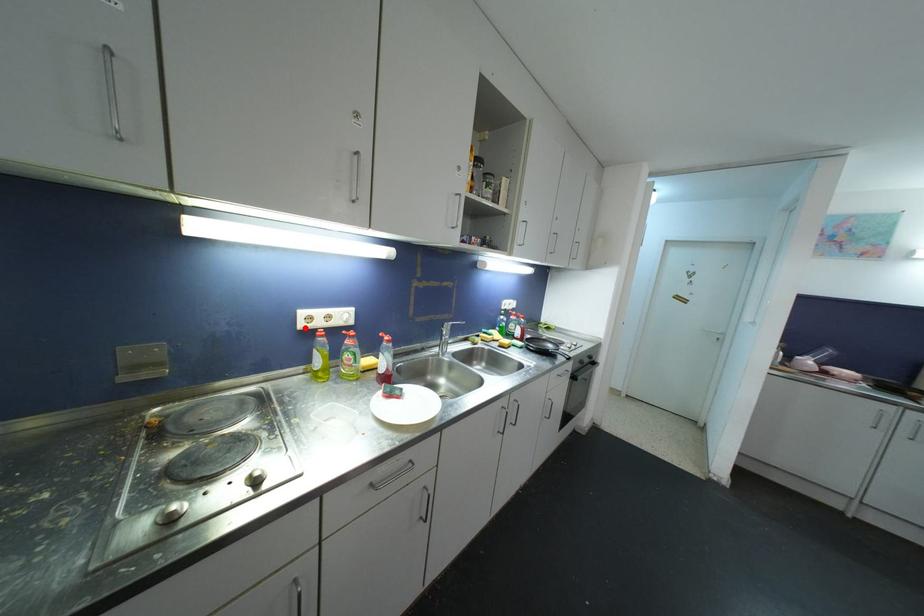
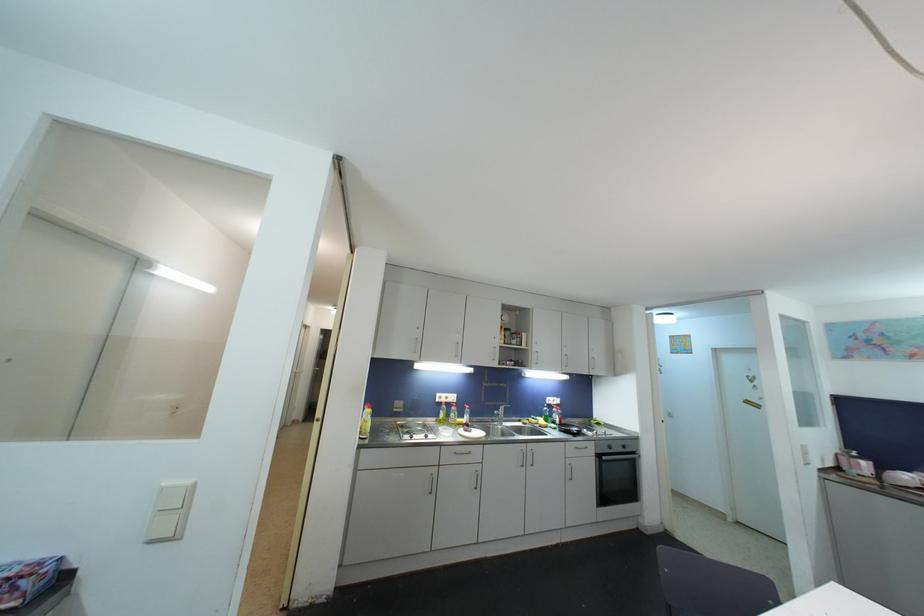
Find the pixel in the second image that matches the highlighted location in the first image.

(441, 403)